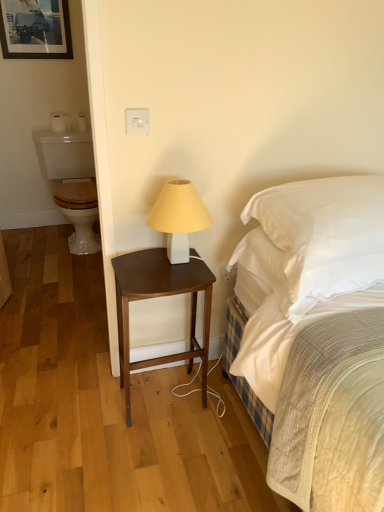
I want to click on free space to the left of dark wood nightstand at center, so click(x=93, y=410).